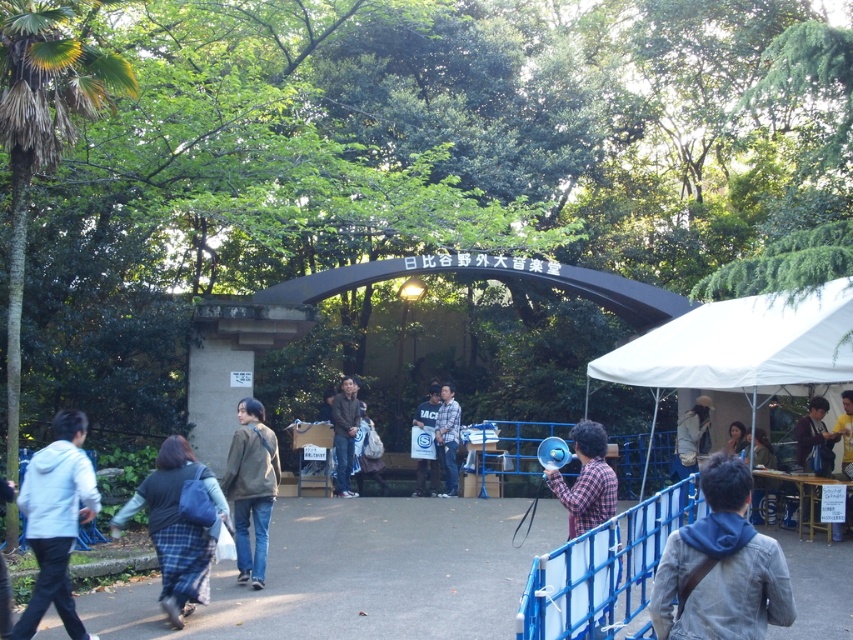
Question: Estimate the real-world distances between objects in this image. Which object is closer to the light brown hair at upper right?

Choices:
 (A) gray hoodie at lower right
 (B) smooth asphalt path at center
 (C) olive green hoodie at lower left

Answer: (B)

Question: Considering the relative positions of gray hoodie at lower right and dark brown hair at center in the image provided, where is gray hoodie at lower right located with respect to dark brown hair at center?

Choices:
 (A) below
 (B) above

Answer: (B)

Question: Which point is farther to the camera?

Choices:
 (A) (810, 419)
 (B) (564, 490)

Answer: (A)

Question: Is olive green hoodie at lower left positioned before light brown hair at upper right?

Choices:
 (A) no
 (B) yes

Answer: (B)

Question: Considering the relative positions of dark brown leather jacket at center and yellow fabric at upper right in the image provided, where is dark brown leather jacket at center located with respect to yellow fabric at upper right?

Choices:
 (A) above
 (B) below

Answer: (B)

Question: Among these points, which one is nearest to the camera?

Choices:
 (A) (689, 460)
 (B) (418, 538)

Answer: (B)